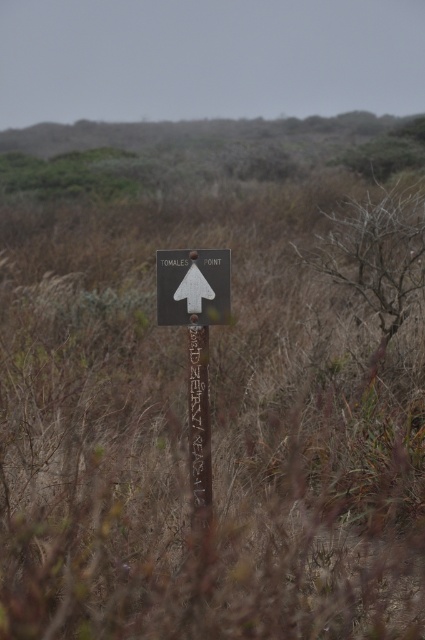
What do you see at coordinates (195, 348) in the screenshot?
I see `metallic gray signpost at center` at bounding box center [195, 348].

Does point (223, 260) come behind point (198, 276)?

No, (223, 260) is in front of (198, 276).

Between point (189, 468) and point (176, 291), which one is positioned in front?

Point (189, 468) is more forward.

Locate an element on the screen. Image resolution: width=425 pixels, height=640 pixels. metallic gray signpost at center is located at coordinates click(x=195, y=348).

Describe the element at coordinates (195, 348) in the screenshot. I see `metallic gray signpost at center` at that location.

Which is below, metallic gray signpost at center or metallic sign at center?

metallic gray signpost at center is below.

Who is more forward, (x=217, y=266) or (x=178, y=269)?

Point (x=217, y=266)

Find the location of a particular element. This screenshot has width=425, height=640. metallic gray signpost at center is located at coordinates (195, 348).

The image size is (425, 640). I want to click on metallic sign at center, so click(x=192, y=285).

Who is higher up, metallic sign at center or white matte arrow at center?

white matte arrow at center is above.

Does point (227, 259) come closer to viewer compared to point (187, 301)?

Yes.

Where is `metallic sign at center`? This screenshot has width=425, height=640. metallic sign at center is located at coordinates (192, 285).